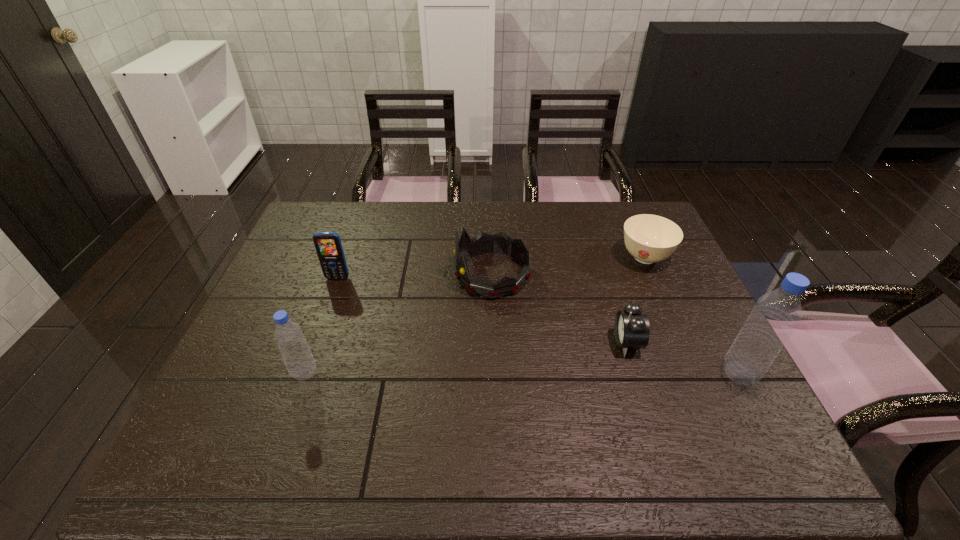
Point out which object is positioned as the second nearest to the cellular telephone. Please provide its 2D coordinates. Your answer should be formatted as a tuple, i.e. [(x, y)], where the tuple contains the x and y coordinates of a point satisfying the conditions above.

[(483, 243)]

The height and width of the screenshot is (540, 960). I want to click on blank space that satisfies the following two spatial constraints: 1. on the front side of the right bottle; 2. on the left side of the alarm clock, so click(x=636, y=373).

Find the location of a particular element. Image resolution: width=960 pixels, height=540 pixels. free space in the image that satisfies the following two spatial constraints: 1. on the front side of the tallest object; 2. on the right side of the sugar bowl is located at coordinates (695, 373).

Where is `vacant region that satisfies the following two spatial constraints: 1. on the front side of the third object from right to left; 2. on the left side of the right bottle`? This screenshot has height=540, width=960. vacant region that satisfies the following two spatial constraints: 1. on the front side of the third object from right to left; 2. on the left side of the right bottle is located at coordinates (636, 373).

At what (x,y) coordinates should I click in order to perform the action: click on free space in the image that satisfies the following two spatial constraints: 1. at the front of the tiara with jewels; 2. on the right side of the tallest object. Please return your answer as a coordinate pair (x, y). The height and width of the screenshot is (540, 960). Looking at the image, I should click on (495, 373).

Where is `vacant area in the image that satisfies the following two spatial constraints: 1. at the front of the fourth object from right to left with jewels; 2. on the screen of the cellular telephone`? The image size is (960, 540). vacant area in the image that satisfies the following two spatial constraints: 1. at the front of the fourth object from right to left with jewels; 2. on the screen of the cellular telephone is located at coordinates (492, 278).

Locate an element on the screen. This screenshot has width=960, height=540. vacant space that satisfies the following two spatial constraints: 1. at the front of the tiara with jewels; 2. on the front side of the fifth shortest object is located at coordinates (495, 373).

Where is `free space that satisfies the following two spatial constraints: 1. on the front side of the fourth object from left to right; 2. on the right side of the taller bottle`? Image resolution: width=960 pixels, height=540 pixels. free space that satisfies the following two spatial constraints: 1. on the front side of the fourth object from left to right; 2. on the right side of the taller bottle is located at coordinates 636,373.